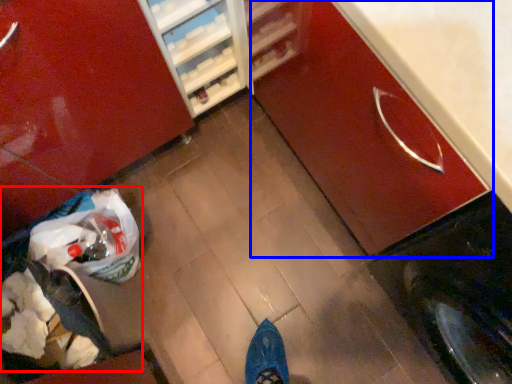
Question: Which point is closer to the camera, garbage (highlighted by a red box) or cabinetry (highlighted by a blue box)?

Choices:
 (A) garbage
 (B) cabinetry

Answer: (B)